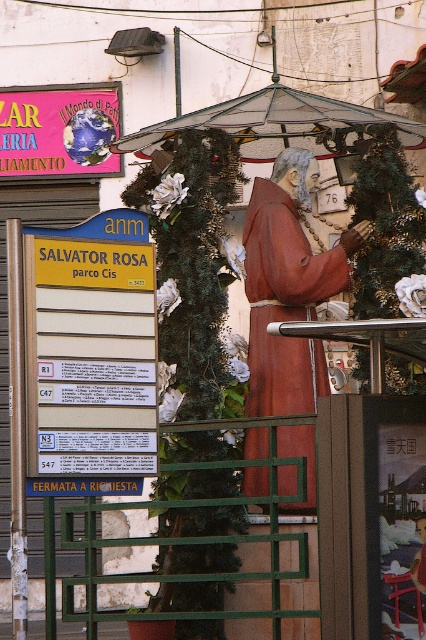
You are a tourist holding a map and looking at the stained glass canopy at center and the pink paper sign at upper left. According to the map, you need to determine which object is shorter to locate the correct path. Which one is shorter?

The stained glass canopy at center is shorter than the pink paper sign at upper left, so the stained glass canopy at center is the shorter object.

You are a tourist holding a map that is 30 cm wide. You want to place it between the stained glass canopy at center and the pink paper sign at upper left. Can the map fit horizontally between them?

The stained glass canopy at center has a lesser width compared to the pink paper sign at upper left. Since the map is 30 cm wide, it depends on the actual space between them. However, the description only provides relative width comparisons between the objects themselves, not the distance between them. Therefore, we cannot determine if the map will fit based on the given information.